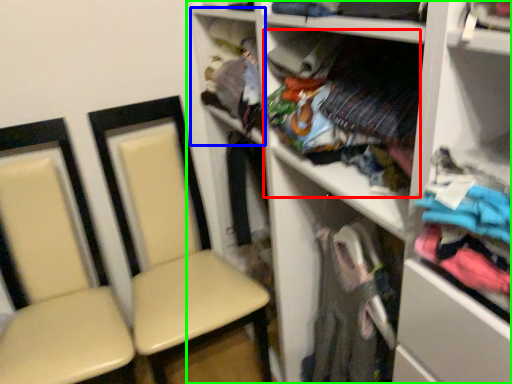
Question: Estimate the real-world distances between objects in this image. Which object is closer to clothing (highlighted by a red box), cabinet (highlighted by a blue box) or shelf (highlighted by a green box)?

Choices:
 (A) cabinet
 (B) shelf

Answer: (B)